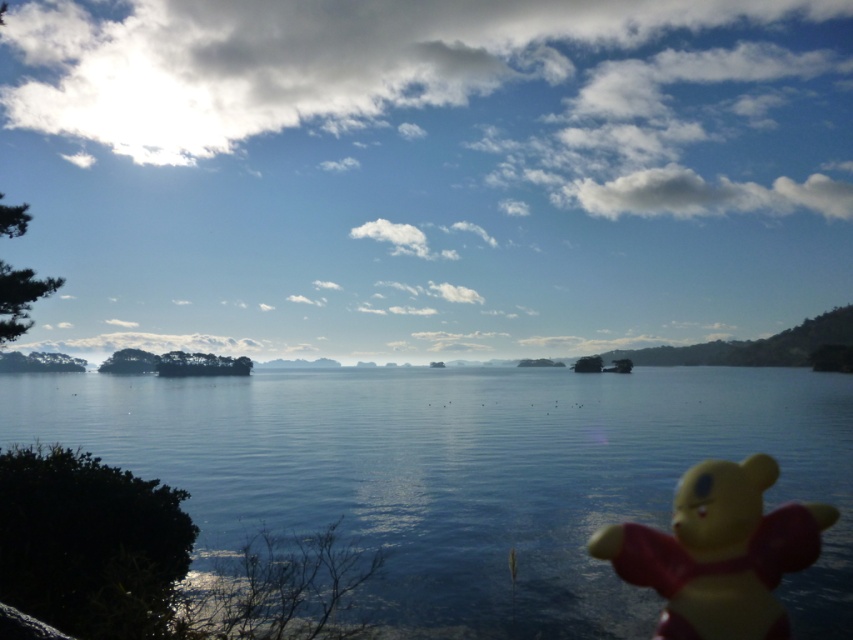
Question: Does transparent water at center have a lesser width compared to yellow matte bear at lower right?

Choices:
 (A) yes
 (B) no

Answer: (B)

Question: Does transparent water at center appear on the right side of yellow matte bear at lower right?

Choices:
 (A) yes
 (B) no

Answer: (B)

Question: Where is transparent water at center located in relation to yellow matte bear at lower right in the image?

Choices:
 (A) above
 (B) below

Answer: (B)

Question: Among these objects, which one is nearest to the camera?

Choices:
 (A) transparent water at center
 (B) yellow matte bear at lower right

Answer: (B)